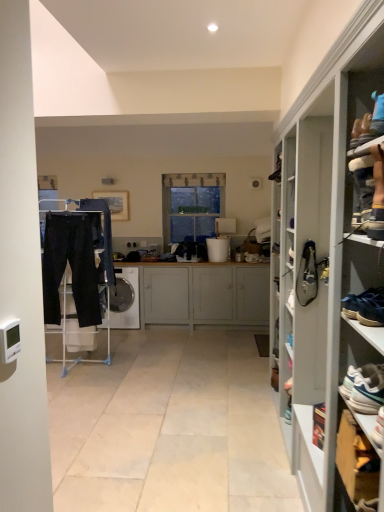
Question: Which is correct: white glossy trash can at center is inside black leather shoe at right, acting as the first shoe starting from the top, or outside of it?

Choices:
 (A) inside
 (B) outside

Answer: (B)

Question: In the image, is white glossy trash can at center on the left side or the right side of black leather shoe at right, marked as the first shoe in a back-to-front arrangement?

Choices:
 (A) left
 (B) right

Answer: (A)

Question: Based on their relative distances, which object is farther from the white glossy dishwasher at center?

Choices:
 (A) black leather shoe at right, positioned as the 2th shoe in bottom-to-top order
 (B) white glossy cupboard at right
 (C) clear glass window at center
 (D) wooden cabinet at lower right
 (E) black cotton trousers at left

Answer: (D)

Question: Estimate the real-world distances between objects in this image. Which object is closer to the clear glass window at center?

Choices:
 (A) white glossy dishwasher at center
 (B) white glossy cupboard at right
 (C) white matte cabinet at center
 (D) white leather sneaker at lower right, the first shoe in the bottom-to-top sequence
 (E) wooden cabinet at lower right

Answer: (C)